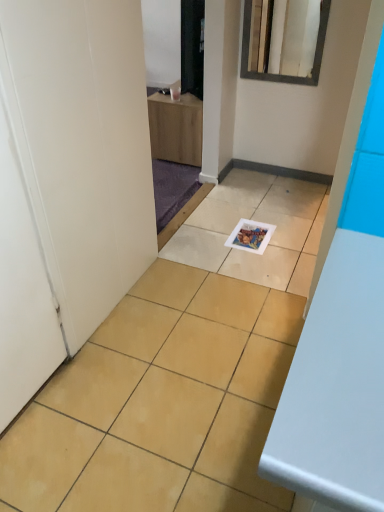
Locate an element on the screen. vacant area that lies in front of white matte door at left is located at coordinates (51, 455).